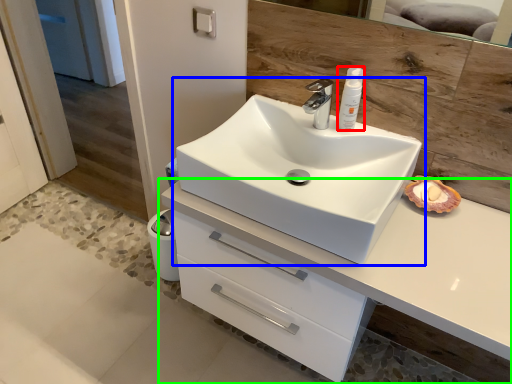
Question: Estimate the real-world distances between objects in this image. Which object is farther from toiletry (highlighted by a red box), sink (highlighted by a blue box) or bathroom cabinet (highlighted by a green box)?

Choices:
 (A) sink
 (B) bathroom cabinet

Answer: (B)